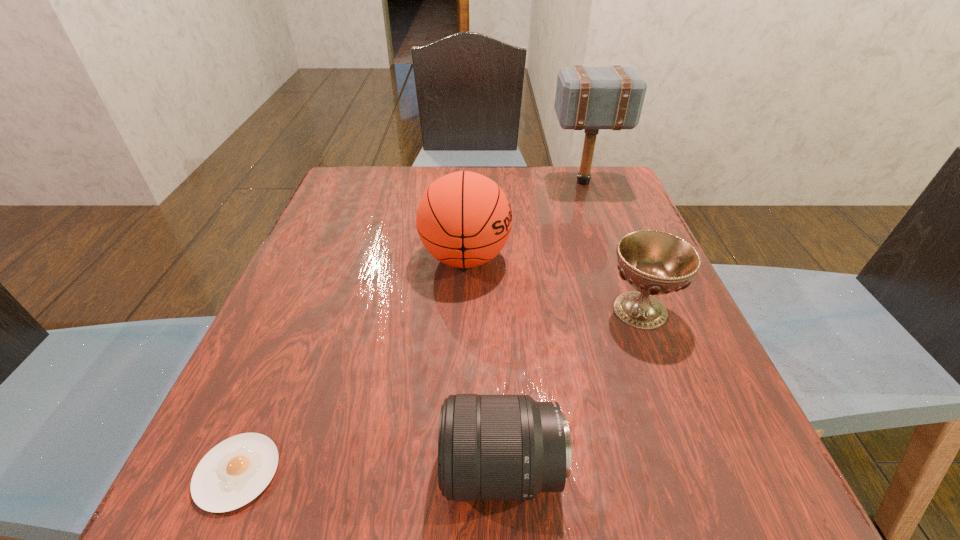
Locate an element on the screen. The image size is (960, 540). free space that is in between the chalice and the basketball is located at coordinates (553, 284).

Locate an element on the screen. The height and width of the screenshot is (540, 960). vacant area that lies between the fourth shortest object and the leftmost object is located at coordinates (351, 365).

The image size is (960, 540). Identify the location of vacant space that is in between the fourth shortest object and the mallet. (525, 220).

Image resolution: width=960 pixels, height=540 pixels. Find the location of `vacant area between the chalice and the telephoto lens`. vacant area between the chalice and the telephoto lens is located at coordinates (571, 390).

Identify the location of unoccupied area between the telephoto lens and the shortest object. This screenshot has width=960, height=540. (370, 471).

You are a GUI agent. You are given a task and a screenshot of the screen. Output one action in this format:
    pyautogui.click(x=<x>, y=<y>)
    Task: Click on the blank region between the chalice and the mallet
    Image resolution: width=960 pixels, height=540 pixels.
    Given the screenshot: What is the action you would take?
    pyautogui.click(x=612, y=246)

Locate an element on the screen. The image size is (960, 540). free spot between the farthest object and the telephoto lens is located at coordinates (543, 326).

Image resolution: width=960 pixels, height=540 pixels. Identify the location of vacant area that lies between the egg yolk and the chalice. (439, 391).

Find the location of a particular element. The width and height of the screenshot is (960, 540). vacant area that lies between the telephoto lens and the chalice is located at coordinates (571, 390).

Locate an element on the screen. The width and height of the screenshot is (960, 540). empty location between the chalice and the leftmost object is located at coordinates (439, 391).